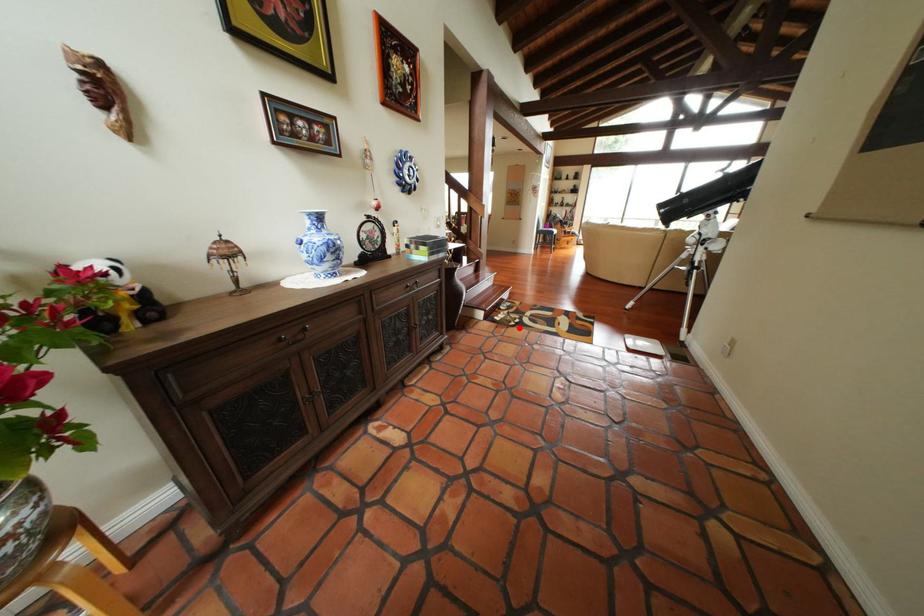
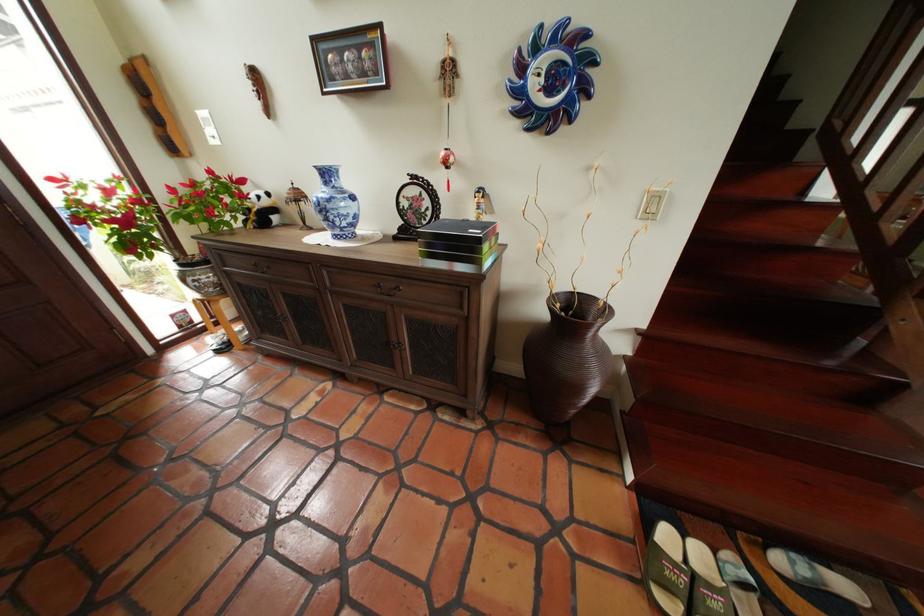
In the second image, find the point that corresponds to the highlighted location in the first image.

(651, 578)